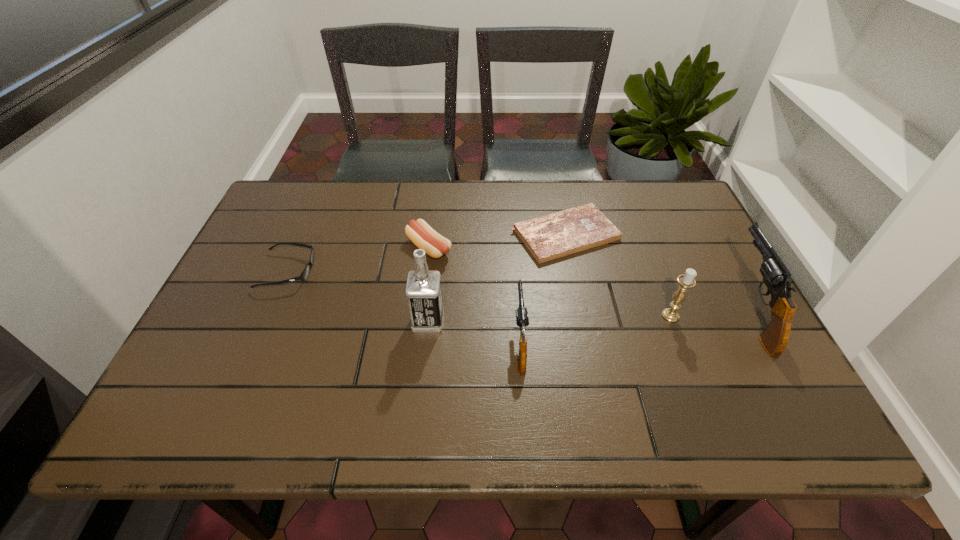
Where is `unoccupied position between the leftmost object and the sausage`? The width and height of the screenshot is (960, 540). unoccupied position between the leftmost object and the sausage is located at coordinates (358, 259).

Identify the location of unoccupied position between the vodka and the fourth shortest object. This screenshot has height=540, width=960. (474, 331).

I want to click on empty location between the Bible and the candle holder, so [618, 275].

Find the location of a particular element. The width and height of the screenshot is (960, 540). unoccupied position between the sausage and the sixth tallest object is located at coordinates (358, 259).

Where is `empty space between the sixth object from left to right and the tallest object`? The image size is (960, 540). empty space between the sixth object from left to right and the tallest object is located at coordinates (549, 318).

The height and width of the screenshot is (540, 960). Find the location of `free space that is in between the candle holder and the rightmost object`. free space that is in between the candle holder and the rightmost object is located at coordinates (710, 313).

Locate an element on the screen. vacant area that lies between the sixth tallest object and the third shortest object is located at coordinates (358, 259).

This screenshot has width=960, height=540. What are the coordinates of `object that is the second nearest to the candle holder` in the screenshot? It's located at (549, 237).

Where is `the closest object to the shortest object`? Image resolution: width=960 pixels, height=540 pixels. the closest object to the shortest object is located at coordinates (686, 281).

Where is `vacant region that satisfies the following two spatial constraints: 1. on the front-facing side of the second object from right to left; 2. on the left side of the sixth tallest object`? This screenshot has width=960, height=540. vacant region that satisfies the following two spatial constraints: 1. on the front-facing side of the second object from right to left; 2. on the left side of the sixth tallest object is located at coordinates (269, 315).